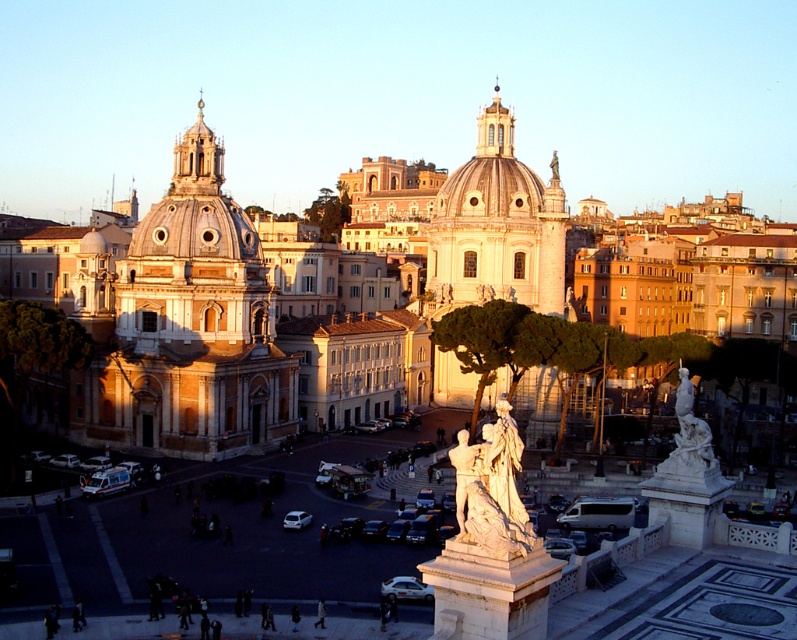
You are standing in the urban scene and want to know how far the point at coordinates (695,480) is from your current position. Can you determine the distance?

The point at coordinates (695,480) is 72.47 meters away from your current position.